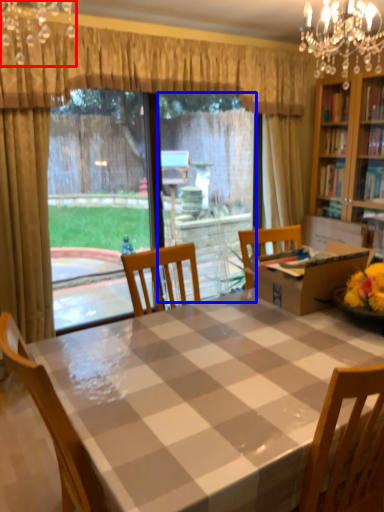
Question: Which object is closer to the camera taking this photo, light fixture (highlighted by a red box) or window screen (highlighted by a blue box)?

Choices:
 (A) light fixture
 (B) window screen

Answer: (A)